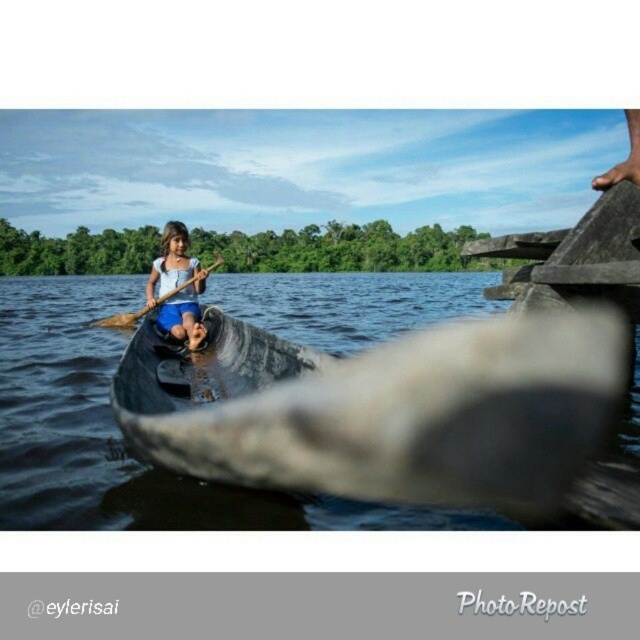
Question: Among these points, which one is nearest to the camera?

Choices:
 (A) (106, 317)
 (B) (168, 264)
 (C) (300, 474)

Answer: (C)

Question: Does dark gray wooden canoe at center have a smaller size compared to wooden at left?

Choices:
 (A) no
 (B) yes

Answer: (A)

Question: Which point is closer to the camera taking this photo?

Choices:
 (A) (182, 241)
 (B) (144, 404)

Answer: (B)

Question: Can you confirm if dark gray wooden canoe at center is wider than wooden at left?

Choices:
 (A) yes
 (B) no

Answer: (A)

Question: Which object is farther from the camera taking this photo?

Choices:
 (A) matte blue dress at center
 (B) dark gray wooden canoe at center

Answer: (A)

Question: Is matte blue dress at center behind wooden at left?

Choices:
 (A) yes
 (B) no

Answer: (B)